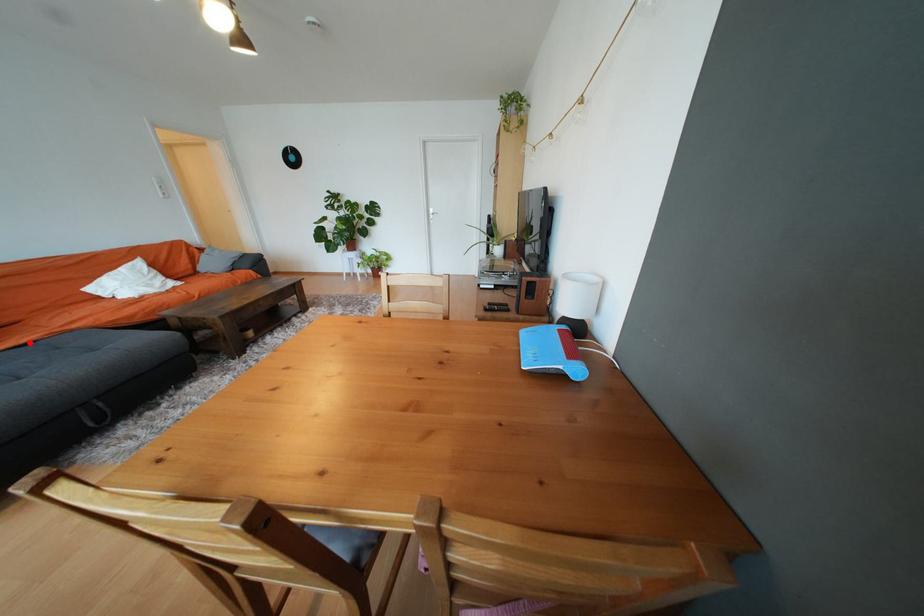
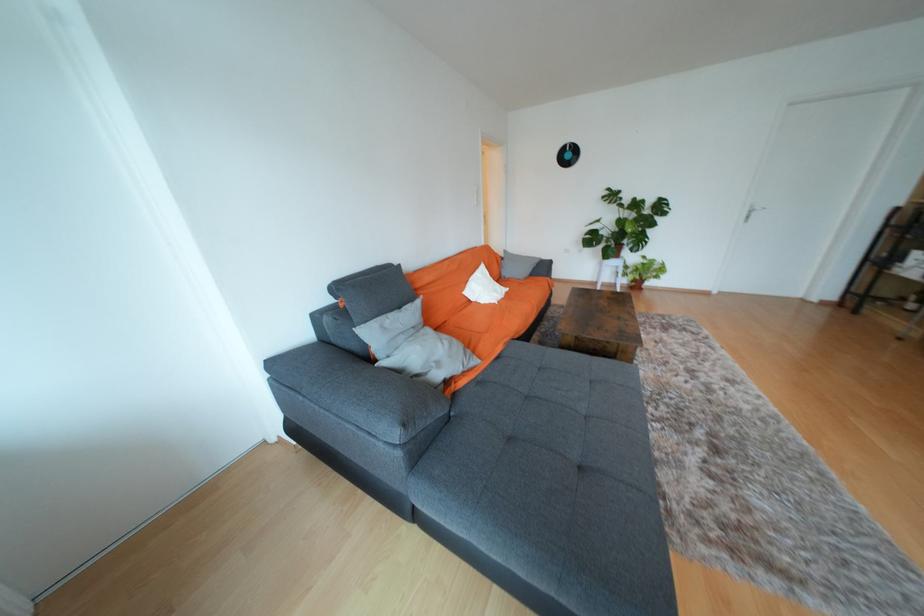
Question: I am providing you with two images of the same scene from different viewpoints. A red point is shown in image1. For the corresponding object point in image2, is it positioned nearer or farther from the camera?

Choices:
 (A) Nearer
 (B) Farther

Answer: (A)